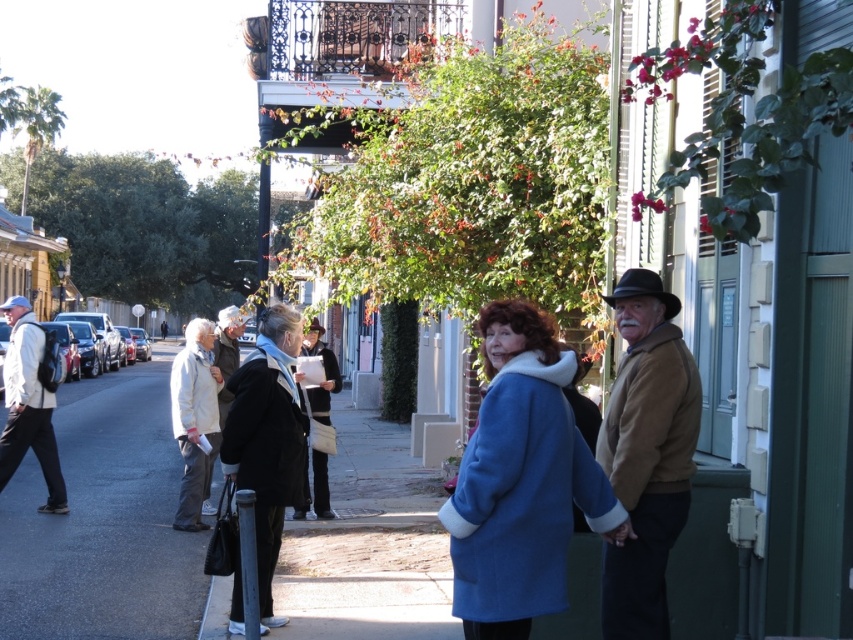
From the picture: Is dark asphalt pavement at lower left above black leather coat at center?

Actually, dark asphalt pavement at lower left is below black leather coat at center.

Is dark asphalt pavement at lower left taller than black leather coat at center?

In fact, dark asphalt pavement at lower left may be shorter than black leather coat at center.

Where is `dark asphalt pavement at lower left`? dark asphalt pavement at lower left is located at coordinates (103, 520).

Can you confirm if velvet blue coat at center is positioned above black wool coat at center?

Indeed, velvet blue coat at center is positioned over black wool coat at center.

Who is taller, velvet blue coat at center or black wool coat at center?

With more height is black wool coat at center.

Where is `velvet blue coat at center`? The height and width of the screenshot is (640, 853). velvet blue coat at center is located at coordinates (521, 481).

The height and width of the screenshot is (640, 853). What are the coordinates of `velvet blue coat at center` in the screenshot? It's located at [x=521, y=481].

How much distance is there between matte black backpack at left and light beige coat at center?

matte black backpack at left is 2.13 meters from light beige coat at center.

Which is in front, point (57, 480) or point (225, 353)?

Point (57, 480) is more forward.

In order to click on matte black backpack at left in this screenshot , I will do `click(28, 404)`.